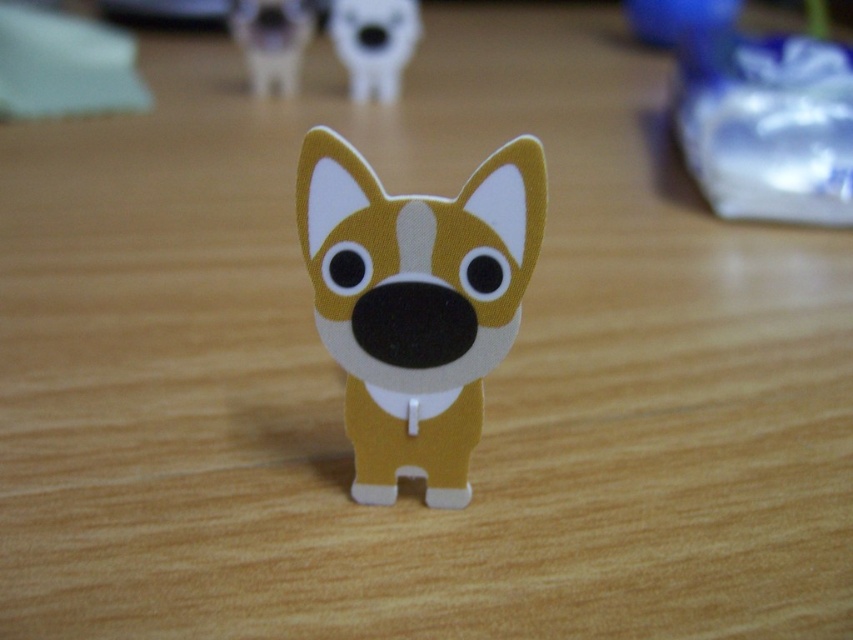
In the scene shown: Please look at the wooden surface. There is a point at coordinates (416, 301). Is there an object at that point?

The matte cardboard dog at center is located at point (416, 301), so yes, there is an object at that point.

You are a robot trying to pick up the figurine. The robot has a camera that can detect two points in the scene. The first point is at coordinates point (370, 3) and the second point is at point (289, 26). Which point is closer to the robot?

Point (370, 3) is in front of point (289, 26), so the first point is closer to the robot.